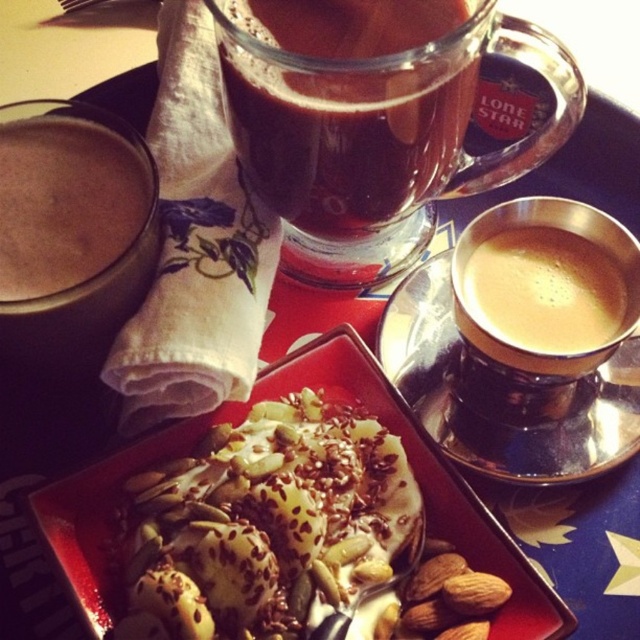
Can you confirm if transparent glass cup at upper center is taller than matte brown coffee at left?

Indeed, transparent glass cup at upper center has a greater height compared to matte brown coffee at left.

Can you confirm if transparent glass cup at upper center is thinner than matte brown coffee at left?

No.

Where is `transparent glass cup at upper center`? This screenshot has height=640, width=640. transparent glass cup at upper center is located at coordinates (388, 134).

Who is shorter, white creamy dessert at center or matte brown coffee at left?

With less height is matte brown coffee at left.

Is white creamy dessert at center in front of matte brown coffee at left?

That is True.

Locate an element on the screen. white creamy dessert at center is located at coordinates (269, 525).

Is transparent glass cup at upper center closer to camera compared to white creamy dessert at center?

No, transparent glass cup at upper center is behind white creamy dessert at center.

Is point (481, 60) farther from camera compared to point (346, 582)?

Yes, point (481, 60) is behind point (346, 582).

Between point (413, 128) and point (136, 572), which one is positioned behind?

The point (413, 128) is behind.

The width and height of the screenshot is (640, 640). What are the coordinates of `transparent glass cup at upper center` in the screenshot? It's located at tap(388, 134).